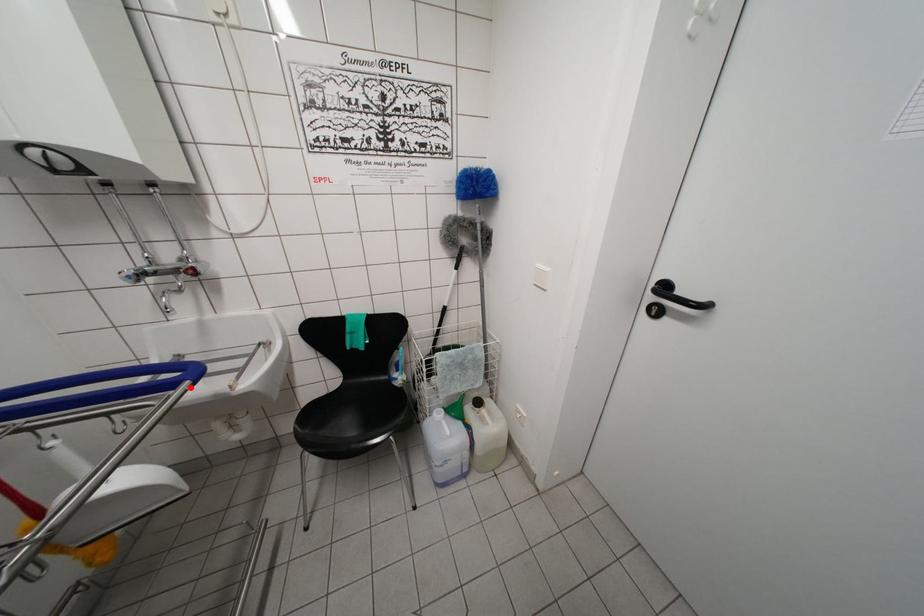
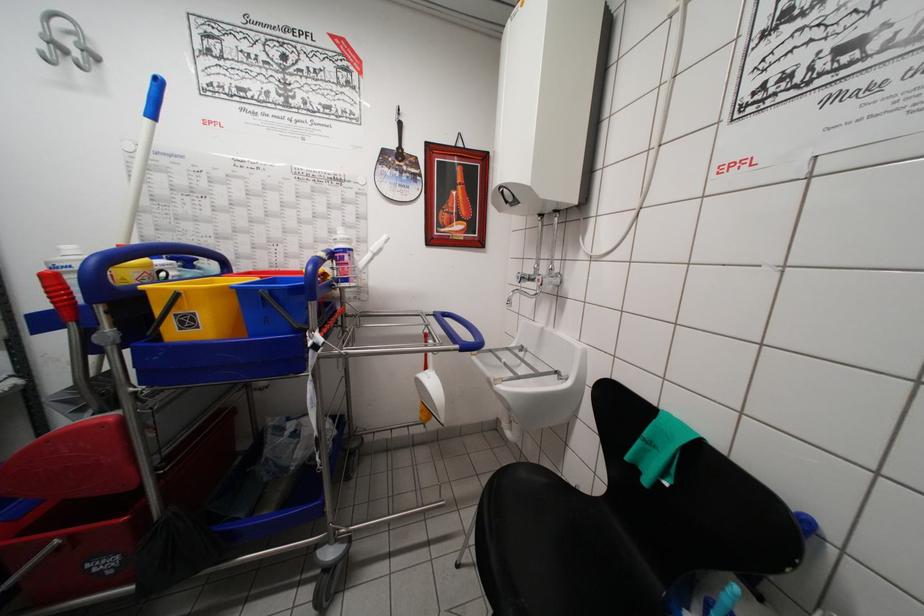
Question: I am providing you with two images of the same scene from different viewpoints. A red point is marked on the first image. At the location where the point appears in image 1, is it still visible in image 2?

Choices:
 (A) Yes
 (B) No

Answer: (A)